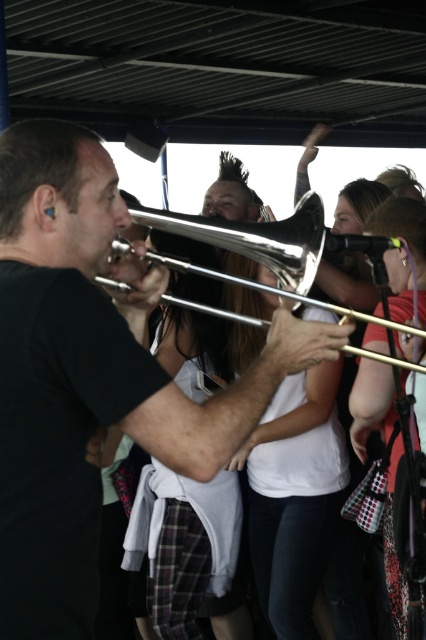
Question: Considering the relative positions of shiny silver trombone at center and shiny silver trumpet at center in the image provided, where is shiny silver trombone at center located with respect to shiny silver trumpet at center?

Choices:
 (A) below
 (B) above

Answer: (A)

Question: Which of the following is the farthest from the observer?

Choices:
 (A) shiny silver trumpet at center
 (B) shiny silver trombone at center

Answer: (A)

Question: Is shiny silver trombone at center bigger than shiny silver trumpet at center?

Choices:
 (A) no
 (B) yes

Answer: (B)

Question: Does shiny silver trombone at center appear on the right side of shiny silver trumpet at center?

Choices:
 (A) no
 (B) yes

Answer: (A)

Question: Among these objects, which one is nearest to the camera?

Choices:
 (A) shiny silver trombone at center
 (B) shiny silver trumpet at center

Answer: (A)